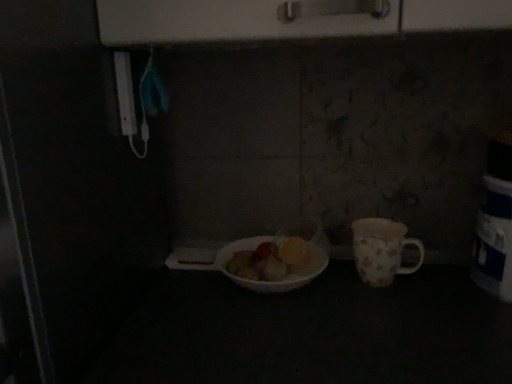
In order to face white glossy bowl at center, should I rotate leftwards or rightwards?

Rotate your view right by about 2.592°.

Describe the element at coordinates (249, 250) in the screenshot. I see `white glossy bowl at center` at that location.

Image resolution: width=512 pixels, height=384 pixels. I want to click on white glossy bowl at center, so click(x=249, y=250).

Describe the element at coordinates (382, 250) in the screenshot. I see `floral porcelain mug at right` at that location.

Identify the location of floral porcelain mug at right. (382, 250).

Locate an element on the screen. This screenshot has width=512, height=384. white glossy bowl at center is located at coordinates (249, 250).

Is floral porcelain mug at right at the left side of white glossy bowl at center?

In fact, floral porcelain mug at right is to the right of white glossy bowl at center.

Considering the positions of objects floral porcelain mug at right and white glossy bowl at center in the image provided, who is behind, floral porcelain mug at right or white glossy bowl at center?

floral porcelain mug at right is further from the camera.

Which point is more distant from viewer, (385,229) or (181,250)?

The point (181,250) is more distant.

From the image's perspective, is floral porcelain mug at right over white glossy bowl at center?

Yes.

From a real-world perspective, is floral porcelain mug at right under white glossy bowl at center?

Incorrect, from a real-world perspective, floral porcelain mug at right is higher than white glossy bowl at center.

Can you confirm if floral porcelain mug at right is thinner than white glossy bowl at center?

Correct, the width of floral porcelain mug at right is less than that of white glossy bowl at center.

Does floral porcelain mug at right have a greater height compared to white glossy bowl at center?

Yes, floral porcelain mug at right is taller than white glossy bowl at center.

Consider the image. Between floral porcelain mug at right and white glossy bowl at center, which one has smaller size?

floral porcelain mug at right is smaller.

Can we say floral porcelain mug at right lies outside white glossy bowl at center?

Absolutely, floral porcelain mug at right is external to white glossy bowl at center.

Is floral porcelain mug at right beside white glossy bowl at center?

No, floral porcelain mug at right is not with white glossy bowl at center.

Does floral porcelain mug at right turn towards white glossy bowl at center?

No, floral porcelain mug at right does not turn towards white glossy bowl at center.

How many degrees apart are the facing directions of floral porcelain mug at right and white glossy bowl at center?

There is a 0.000173-degree angle between the facing directions of floral porcelain mug at right and white glossy bowl at center.

How far apart are floral porcelain mug at right and white glossy bowl at center?

floral porcelain mug at right and white glossy bowl at center are 7.98 inches apart.

The image size is (512, 384). In order to click on tableware that is below the floral porcelain mug at right (from the image's perspective) in this screenshot , I will do `click(249, 250)`.

Does white glossy bowl at center appear on the left side of floral porcelain mug at right?

Yes, white glossy bowl at center is to the left of floral porcelain mug at right.

Is white glossy bowl at center further to camera compared to floral porcelain mug at right?

No, it is not.

Does point (257, 237) appear closer or farther from the camera than point (400, 274)?

Clearly, point (257, 237) is more distant from the camera than point (400, 274).

From the image's perspective, who appears lower, white glossy bowl at center or floral porcelain mug at right?

white glossy bowl at center is shown below in the image.

Based on the photo, from a real-world perspective, who is located higher, white glossy bowl at center or floral porcelain mug at right?

From a 3D spatial view, floral porcelain mug at right is above.

Between white glossy bowl at center and floral porcelain mug at right, which one has smaller width?

Thinner between the two is floral porcelain mug at right.

Is white glossy bowl at center shorter than floral porcelain mug at right?

Correct, white glossy bowl at center is not as tall as floral porcelain mug at right.

In terms of size, does white glossy bowl at center appear bigger or smaller than floral porcelain mug at right?

white glossy bowl at center is bigger than floral porcelain mug at right.

Is white glossy bowl at center completely or partially outside of floral porcelain mug at right?

Yes, white glossy bowl at center is outside of floral porcelain mug at right.

Are white glossy bowl at center and floral porcelain mug at right making contact?

white glossy bowl at center and floral porcelain mug at right are not in contact.

Is white glossy bowl at center facing towards floral porcelain mug at right?

No, white glossy bowl at center is not oriented towards floral porcelain mug at right.

How different are the orientations of white glossy bowl at center and floral porcelain mug at right in degrees?

The facing directions of white glossy bowl at center and floral porcelain mug at right are 0.000173 degrees apart.

The image size is (512, 384). Find the location of `tableware on the left of floral porcelain mug at right`. tableware on the left of floral porcelain mug at right is located at coordinates (249, 250).

The width and height of the screenshot is (512, 384). I want to click on tableware on the left of floral porcelain mug at right, so click(249, 250).

The image size is (512, 384). Identify the location of coffee cup that is above the white glossy bowl at center (from a real-world perspective). (382, 250).